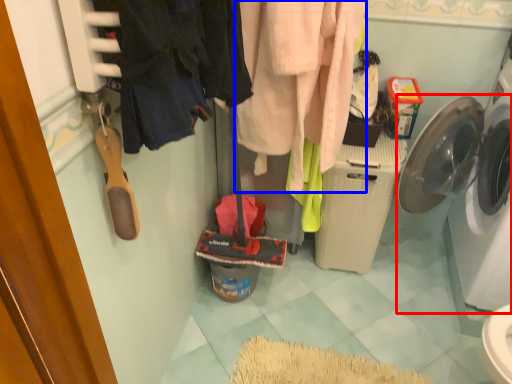
Question: Among these objects, which one is nearest to the camera, washing machine (highlighted by a red box) or clothing (highlighted by a blue box)?

Choices:
 (A) washing machine
 (B) clothing

Answer: (B)